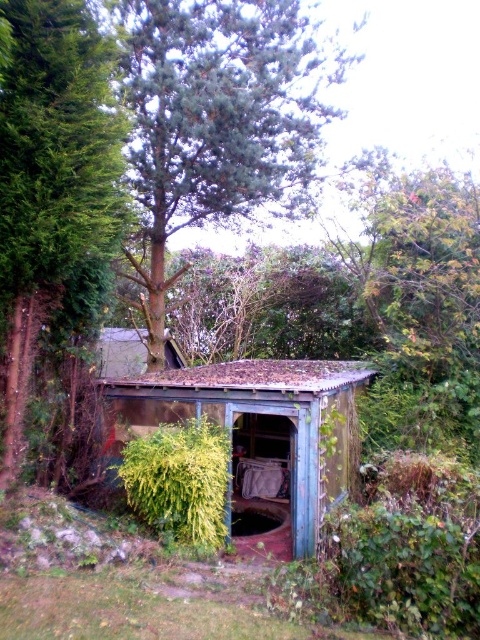
Question: Which point is closer to the camera?

Choices:
 (A) weathered wood shed at center
 (B) green leafy plant at center

Answer: (B)

Question: Does green leafy tree at upper center have a smaller size compared to green leafy tree at left?

Choices:
 (A) no
 (B) yes

Answer: (A)

Question: Which of the following is the closest to the observer?

Choices:
 (A) green leafy tree at upper center
 (B) green leafy tree at left
 (C) green leafy plant at center

Answer: (B)

Question: Is green leafy tree at upper center thinner than weathered wood shed at center?

Choices:
 (A) yes
 (B) no

Answer: (B)

Question: Which object is farther from the camera taking this photo?

Choices:
 (A) weathered wood shed at center
 (B) green leafy plant at center
 (C) green leafy tree at upper center
 (D) green leafy tree at left

Answer: (A)

Question: Does green leafy tree at upper center have a lesser width compared to green leafy plant at center?

Choices:
 (A) no
 (B) yes

Answer: (A)